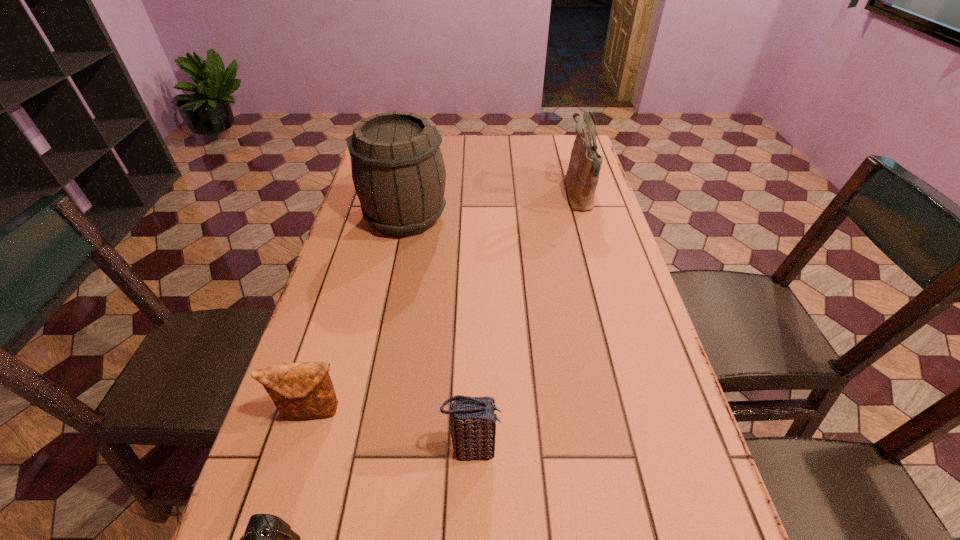
The width and height of the screenshot is (960, 540). Find the location of `wine bucket`. wine bucket is located at coordinates click(x=398, y=171).

Identify the location of shoulder bag. This screenshot has height=540, width=960. (582, 176).

Locate an element on the screen. This screenshot has height=540, width=960. the rightmost clutch bag is located at coordinates pos(472,419).

I want to click on the fourth object from left to right, so click(x=472, y=419).

What are the coordinates of `the farthest clutch bag` in the screenshot? It's located at (304, 390).

Where is `vacant space located on the right of the wine bucket`? vacant space located on the right of the wine bucket is located at coordinates (576, 217).

Locate an element on the screen. This screenshot has height=540, width=960. vacant region located 0.280m on the front-facing side of the rightmost object is located at coordinates (477, 195).

Where is `vacant region located on the front-facing side of the rightmost object`? This screenshot has height=540, width=960. vacant region located on the front-facing side of the rightmost object is located at coordinates (533, 195).

Locate an element on the screen. vacant space located on the front-facing side of the rightmost object is located at coordinates (523, 195).

In order to click on vacant position located 0.110m with the zip open on the second nearest object in this screenshot , I will do `click(558, 449)`.